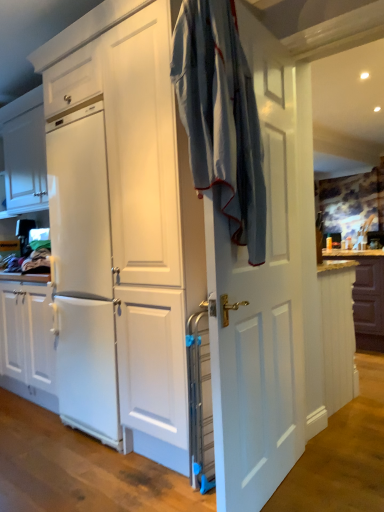
Question: Is white matte cabinet at right situated inside light blue fabric at center or outside?

Choices:
 (A) outside
 (B) inside

Answer: (A)

Question: Visually, is white matte cabinet at right positioned to the left or to the right of light blue fabric at center?

Choices:
 (A) left
 (B) right

Answer: (B)

Question: Considering the real-world distances, which object is closest to the white matte door at center?

Choices:
 (A) light blue fabric at center
 (B) brown wood countertop at right
 (C) white matte cabinet at right

Answer: (A)

Question: Which is farther from the brown wood countertop at right?

Choices:
 (A) white matte cabinet at right
 (B) light blue fabric at center
 (C) white matte door at center

Answer: (B)